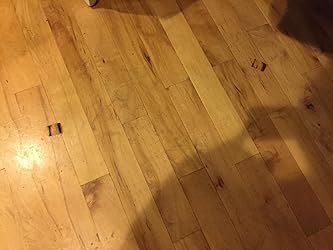
Locate an element on the screen. This screenshot has width=333, height=250. wood floor is located at coordinates (96, 181), (140, 143), (238, 68), (128, 63).